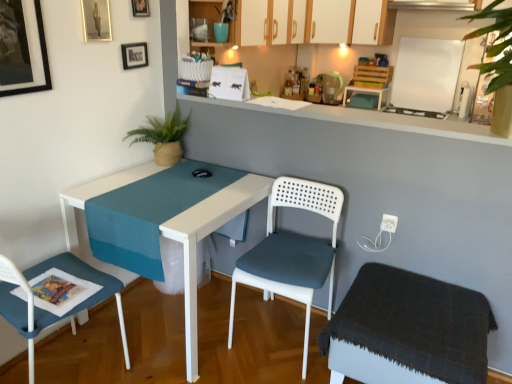
Question: Is matte black picture frame at upper left, marked as the 4th picture frame in a back-to-front arrangement, looking in the opposite direction of dark gray fabric stool at lower right?

Choices:
 (A) yes
 (B) no

Answer: (B)

Question: Is matte black picture frame at upper left, marked as the 4th picture frame in a back-to-front arrangement, at the left side of dark gray fabric stool at lower right?

Choices:
 (A) yes
 (B) no

Answer: (A)

Question: From a real-world perspective, is matte black picture frame at upper left, acting as the 1th picture frame starting from the front, physically above dark gray fabric stool at lower right?

Choices:
 (A) no
 (B) yes

Answer: (B)

Question: Can you confirm if matte black picture frame at upper left, placed as the first picture frame when sorted from left to right, is wider than dark gray fabric stool at lower right?

Choices:
 (A) no
 (B) yes

Answer: (A)

Question: Can you confirm if matte black picture frame at upper left, acting as the 1th picture frame starting from the front, is smaller than dark gray fabric stool at lower right?

Choices:
 (A) yes
 (B) no

Answer: (A)

Question: Is white matte cabinet at upper center, which is the 2th cabinetry in right-to-left order, bigger or smaller than metallic gold picture frame at upper center, which appears as the 3th picture frame when viewed from the front?

Choices:
 (A) small
 (B) big

Answer: (B)

Question: From the image's perspective, relative to metallic gold picture frame at upper center, the fourth picture frame when ordered from left to right, is white matte cabinet at upper center, which is counted as the 2th cabinetry, starting from the front, above or below?

Choices:
 (A) above
 (B) below

Answer: (A)

Question: From a real-world perspective, is white matte cabinet at upper center, which appears as the second cabinetry when viewed from the left, physically located above or below metallic gold picture frame at upper center, which appears as the 3th picture frame when viewed from the front?

Choices:
 (A) above
 (B) below

Answer: (B)

Question: Considering their positions, is white matte cabinet at upper center, which is the second cabinetry from back to front, located in front of or behind metallic gold picture frame at upper center, which appears as the 3th picture frame when viewed from the front?

Choices:
 (A) front
 (B) behind

Answer: (B)

Question: From a real-world perspective, is green woven plant at upper left positioned above or below white plastic table at center?

Choices:
 (A) above
 (B) below

Answer: (A)

Question: Based on their sizes in the image, would you say green woven plant at upper left is bigger or smaller than white plastic table at center?

Choices:
 (A) big
 (B) small

Answer: (B)

Question: In terms of width, does green woven plant at upper left look wider or thinner when compared to white plastic table at center?

Choices:
 (A) wide
 (B) thin

Answer: (B)

Question: Considering the positions of green woven plant at upper left and white plastic table at center in the image, is green woven plant at upper left taller or shorter than white plastic table at center?

Choices:
 (A) tall
 (B) short

Answer: (B)

Question: In terms of width, does white plastic chair at center, which appears as the 2th chair when viewed from the left, look wider or thinner when compared to matte black picture frame at upper left, marked as the 3th picture frame in a left-to-right arrangement?

Choices:
 (A) wide
 (B) thin

Answer: (A)

Question: Is point pyautogui.click(x=297, y=299) closer or farther from the camera than point pyautogui.click(x=134, y=51)?

Choices:
 (A) closer
 (B) farther

Answer: (A)